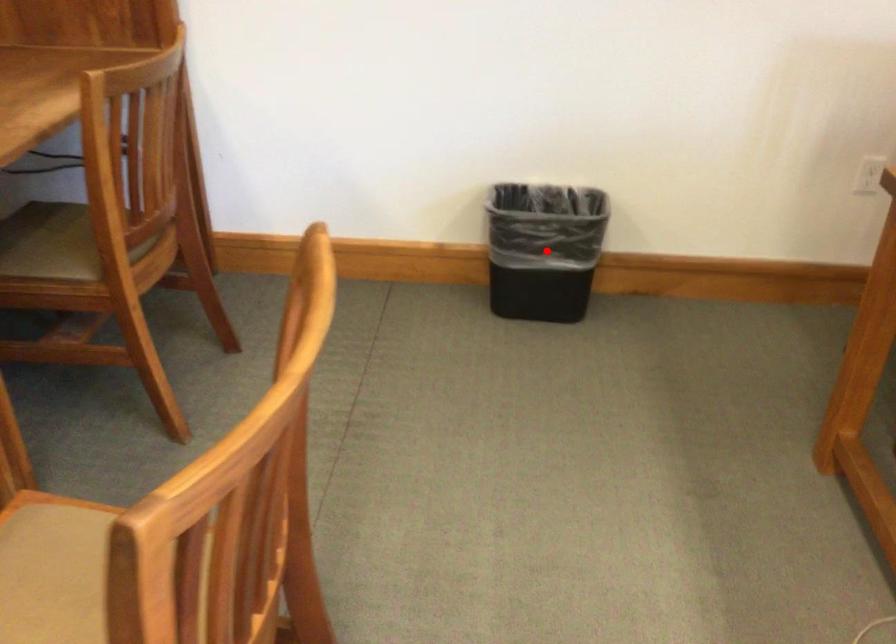
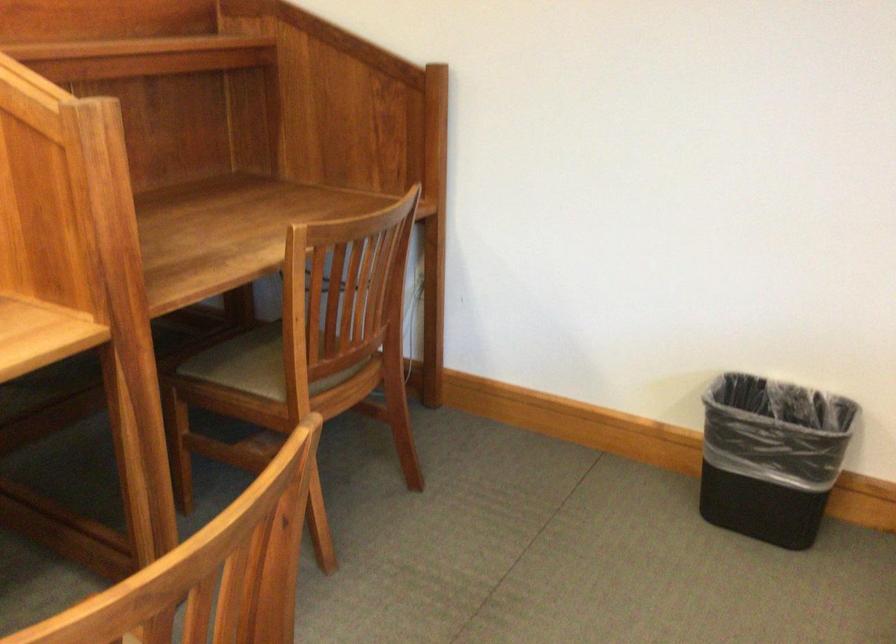
The point at the highlighted location is marked in the first image. Where is the corresponding point in the second image?

(771, 456)